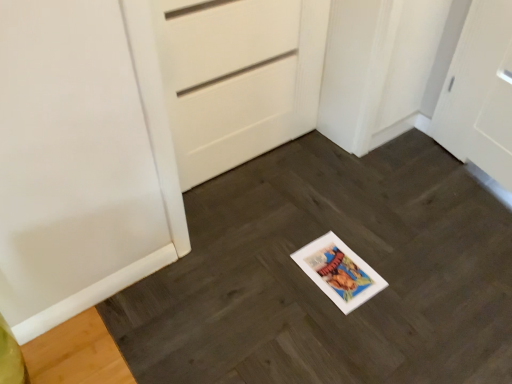
Question: Is white paper at center inside white matte door at center?

Choices:
 (A) yes
 (B) no

Answer: (B)

Question: Is white matte door at center next to white paper at center?

Choices:
 (A) yes
 (B) no

Answer: (B)

Question: Considering the relative positions of white matte door at center and white paper at center in the image provided, is white matte door at center to the left of white paper at center from the viewer's perspective?

Choices:
 (A) no
 (B) yes

Answer: (B)

Question: Is white matte door at center aimed at white paper at center?

Choices:
 (A) no
 (B) yes

Answer: (B)

Question: Is white matte door at center located outside white paper at center?

Choices:
 (A) no
 (B) yes

Answer: (B)

Question: Does white matte door at center have a larger size compared to white paper at center?

Choices:
 (A) yes
 (B) no

Answer: (B)

Question: Is white paper at center closer to the viewer compared to white matte door at center?

Choices:
 (A) no
 (B) yes

Answer: (B)

Question: Is white paper at center wider than white matte door at center?

Choices:
 (A) yes
 (B) no

Answer: (A)

Question: From a real-world perspective, is white paper at center on white matte door at center?

Choices:
 (A) yes
 (B) no

Answer: (B)

Question: Is white paper at center far from white matte door at center?

Choices:
 (A) no
 (B) yes

Answer: (A)

Question: Is white paper at center thinner than white matte door at center?

Choices:
 (A) no
 (B) yes

Answer: (A)

Question: Is white paper at center outside of white matte door at center?

Choices:
 (A) no
 (B) yes

Answer: (B)

Question: Is white paper at center taller or shorter than white matte door at center?

Choices:
 (A) short
 (B) tall

Answer: (A)